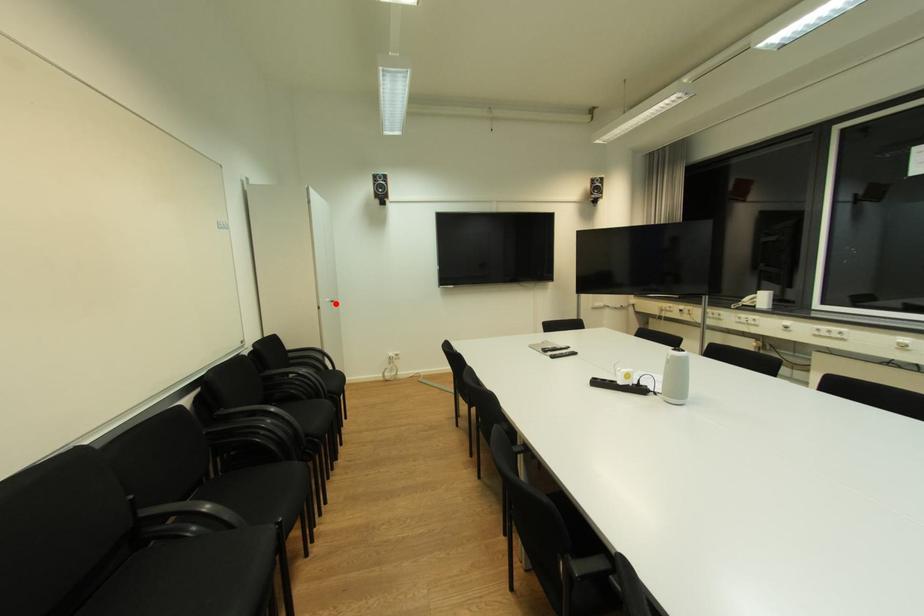
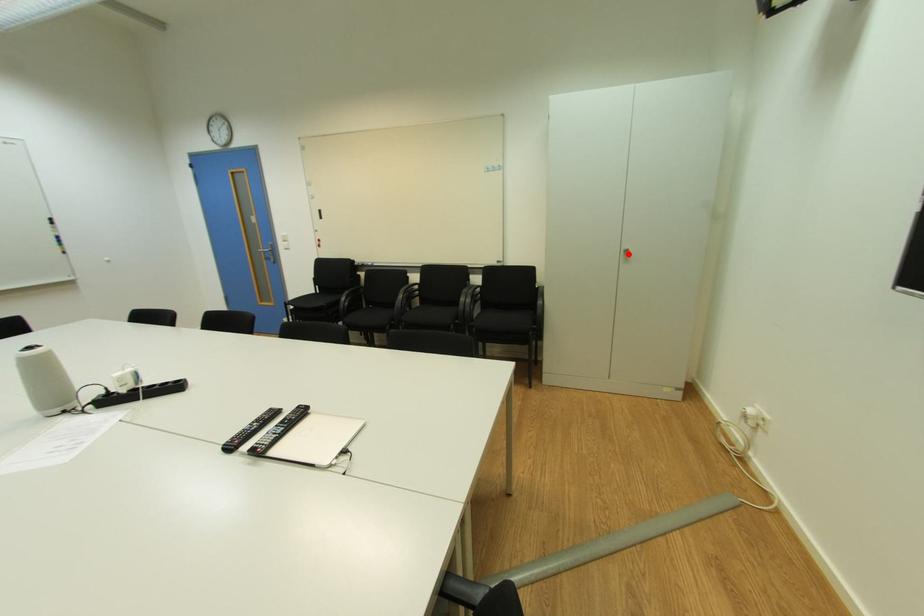
I am providing you with two images of the same scene from different viewpoints. A red point is marked on the first image and another point is marked on the second image. Is the marked point in image1 the same physical position as the marked point in image2?

Yes